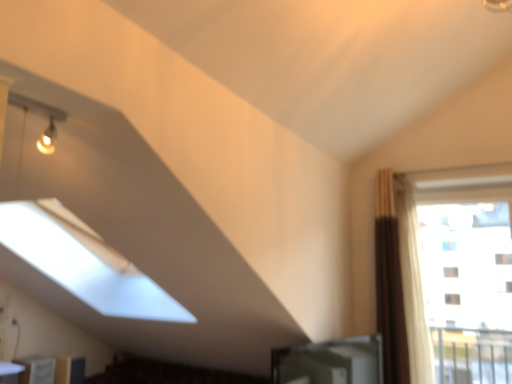
Question: Is white glossy bookshelf at lower left, placed as the second furniture when sorted from back to front, positioned behind transparent glass window at right?

Choices:
 (A) yes
 (B) no

Answer: (B)

Question: From the image's perspective, is white glossy bookshelf at lower left, placed as the first furniture when sorted from front to back, under transparent glass window at right?

Choices:
 (A) yes
 (B) no

Answer: (A)

Question: Considering the relative positions of white glossy bookshelf at lower left, placed as the second furniture when sorted from back to front, and transparent glass window at right in the image provided, is white glossy bookshelf at lower left, placed as the second furniture when sorted from back to front, to the right of transparent glass window at right from the viewer's perspective?

Choices:
 (A) yes
 (B) no

Answer: (B)

Question: From a real-world perspective, is white glossy bookshelf at lower left, placed as the first furniture when sorted from front to back, located beneath transparent glass window at right?

Choices:
 (A) no
 (B) yes

Answer: (B)

Question: From a real-world perspective, is white glossy bookshelf at lower left, placed as the first furniture when sorted from front to back, positioned over transparent glass window at right based on gravity?

Choices:
 (A) yes
 (B) no

Answer: (B)

Question: Is white glossy bookshelf at lower left, placed as the second furniture when sorted from back to front, bigger or smaller than transparent glass window at right?

Choices:
 (A) small
 (B) big

Answer: (A)

Question: Based on their positions, is white glossy bookshelf at lower left, placed as the first furniture when sorted from front to back, located to the left or right of transparent glass window at right?

Choices:
 (A) left
 (B) right

Answer: (A)

Question: In terms of width, does white glossy bookshelf at lower left, placed as the first furniture when sorted from front to back, look wider or thinner when compared to transparent glass window at right?

Choices:
 (A) thin
 (B) wide

Answer: (B)

Question: In the image, is white glossy bookshelf at lower left, placed as the second furniture when sorted from back to front, positioned in front of or behind transparent glass window at right?

Choices:
 (A) front
 (B) behind

Answer: (A)

Question: Is brown fabric curtain at right in front of or behind white glossy table at lower left in the image?

Choices:
 (A) front
 (B) behind

Answer: (B)

Question: From their relative heights in the image, would you say brown fabric curtain at right is taller or shorter than white glossy table at lower left?

Choices:
 (A) tall
 (B) short

Answer: (A)

Question: Is brown fabric curtain at right bigger or smaller than white glossy table at lower left?

Choices:
 (A) big
 (B) small

Answer: (A)

Question: From a real-world perspective, is brown fabric curtain at right positioned above or below white glossy table at lower left?

Choices:
 (A) above
 (B) below

Answer: (A)

Question: From a real-world perspective, relative to white glossy bookshelf at lower left, placed as the first furniture when sorted from front to back, is white glossy table at lower left vertically above or below?

Choices:
 (A) below
 (B) above

Answer: (B)

Question: Choose the correct answer: Is white glossy table at lower left inside white glossy bookshelf at lower left, placed as the second furniture when sorted from back to front, or outside it?

Choices:
 (A) inside
 (B) outside

Answer: (B)